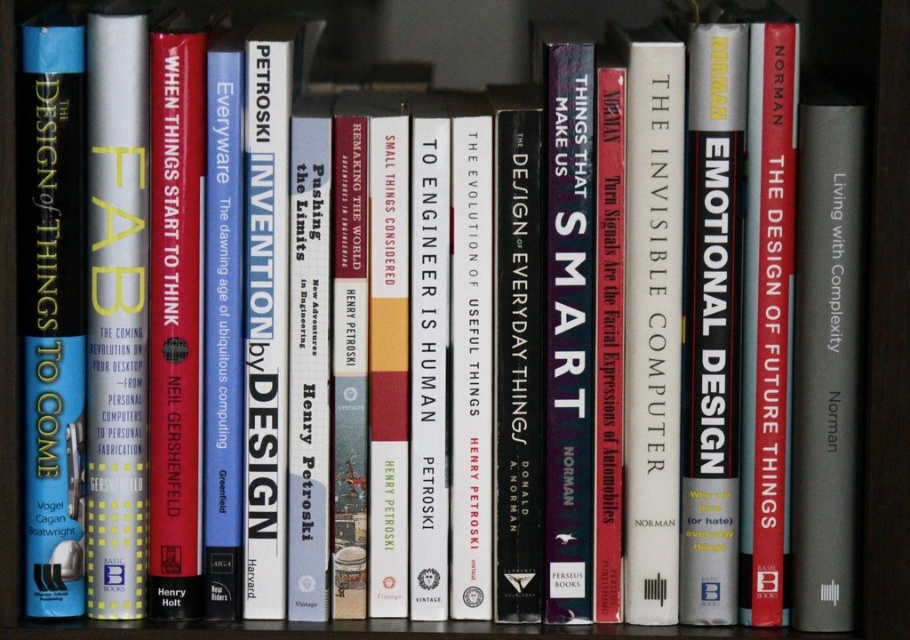
Is gray matte book at center below red matte hardcover book at center?

Indeed, gray matte book at center is positioned under red matte hardcover book at center.

Which is behind, point (848, 97) or point (763, 528)?

The point (763, 528) is behind.

Between point (852, 288) and point (775, 380), which one is positioned behind?

The point (775, 380) is more distant.

The width and height of the screenshot is (910, 640). I want to click on gray matte book at center, so click(825, 360).

Who is more distant from viewer, (49, 81) or (799, 289)?

The point (799, 289) is more distant.

Consider the image. Does blue hardcover book at left have a greater width compared to gray matte book at center?

Correct, the width of blue hardcover book at left exceeds that of gray matte book at center.

Between point (31, 35) and point (805, 259), which one is positioned behind?

Point (805, 259)

You are a GUI agent. You are given a task and a screenshot of the screen. Output one action in this format:
    pyautogui.click(x=<x>, y=<y>)
    Task: Click on the blue hardcover book at left
    This screenshot has width=910, height=640.
    Given the screenshot: What is the action you would take?
    pyautogui.click(x=52, y=310)

Between blue hardcover book at left and red matte hardcover book at center, which one has less height?

red matte hardcover book at center is shorter.

Does blue hardcover book at left have a greater height compared to red matte hardcover book at center?

Yes.

Which is in front, point (35, 506) or point (786, 468)?

Positioned in front is point (35, 506).

Identify the location of blue hardcover book at left. Image resolution: width=910 pixels, height=640 pixels. (52, 310).